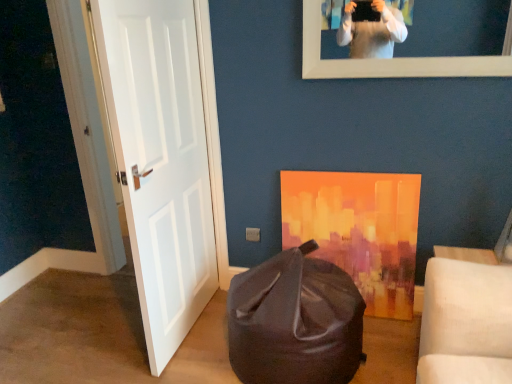
Question: From the image's perspective, relative to white matte picture frame at upper center, is matte black bean bag at lower center above or below?

Choices:
 (A) above
 (B) below

Answer: (B)

Question: Considering the positions of matte black bean bag at lower center and white matte picture frame at upper center in the image, is matte black bean bag at lower center wider or thinner than white matte picture frame at upper center?

Choices:
 (A) wide
 (B) thin

Answer: (A)

Question: Which object is the closest to the white matte door at left?

Choices:
 (A) white matte picture frame at upper center
 (B) matte black bean bag at lower center

Answer: (B)

Question: Which is nearer to the white matte picture frame at upper center?

Choices:
 (A) matte black bean bag at lower center
 (B) white matte door at left

Answer: (B)